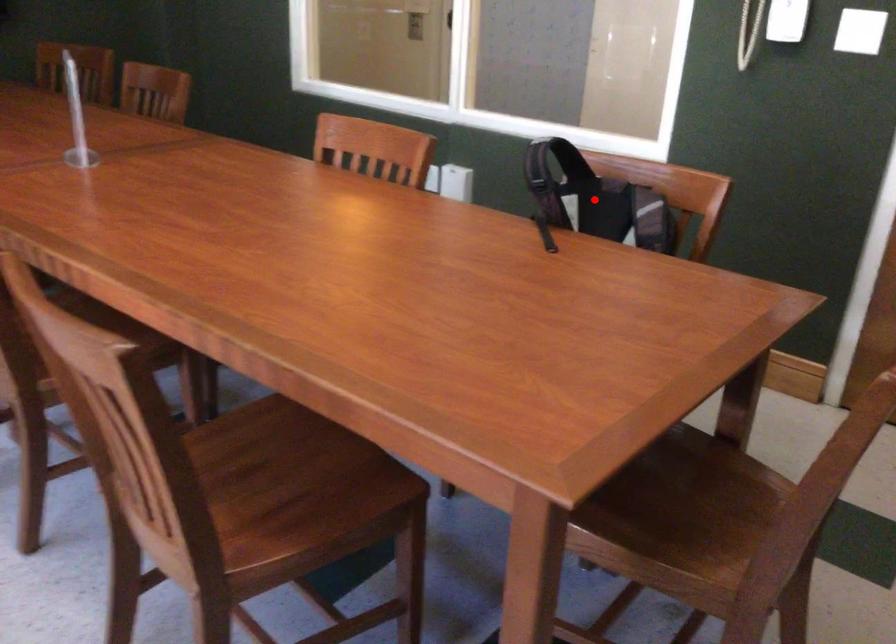
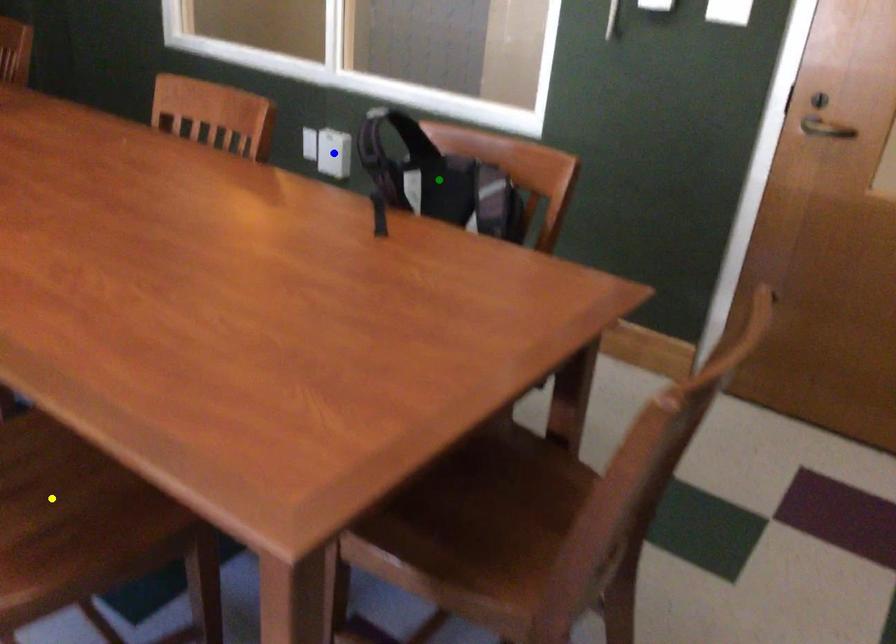
Question: I am providing you with two images of the same scene from different viewpoints. A red point is marked on the first image. You are given multiple points on the second image. Which point in image 2 represents the same 3d spot as the red point in image 1?

Choices:
 (A) blue point
 (B) yellow point
 (C) green point

Answer: (C)